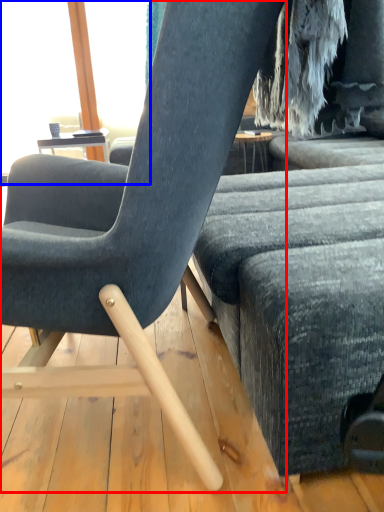
Question: Among these objects, which one is nearest to the camera, chair (highlighted by a red box) or window screen (highlighted by a blue box)?

Choices:
 (A) chair
 (B) window screen

Answer: (A)